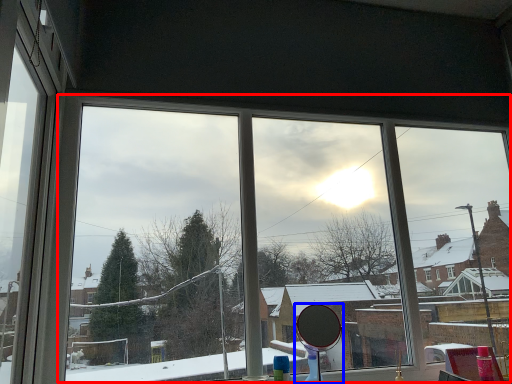
Question: Which object is closer to the camera taking this photo, bay window (highlighted by a red box) or mirror (highlighted by a blue box)?

Choices:
 (A) bay window
 (B) mirror

Answer: (B)